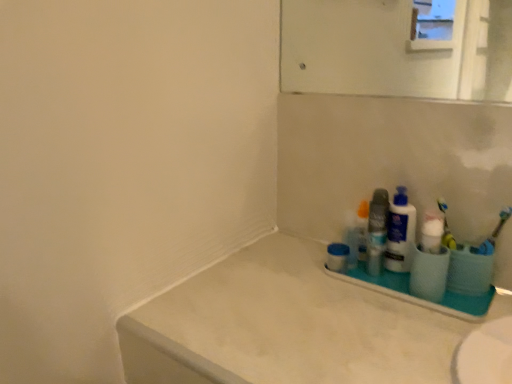
Question: From the image's perspective, is white plastic bottle at right, which is counted as the first cleaning product, starting from the back, on top of yellow plastic toothbrush at right, the 2th toothbrush in the right-to-left sequence?

Choices:
 (A) yes
 (B) no

Answer: (B)

Question: From the image's perspective, is white plastic bottle at right, which is the 2th cleaning product in front-to-back order, located beneath yellow plastic toothbrush at right, the 2th toothbrush in the right-to-left sequence?

Choices:
 (A) no
 (B) yes

Answer: (B)

Question: Does white plastic bottle at right, which is counted as the first cleaning product, starting from the back, have a greater height compared to yellow plastic toothbrush at right, which is counted as the first toothbrush, starting from the left?

Choices:
 (A) no
 (B) yes

Answer: (B)

Question: Is white plastic bottle at right, which is the 2th cleaning product in front-to-back order, wider than yellow plastic toothbrush at right, the 2th toothbrush in the right-to-left sequence?

Choices:
 (A) no
 (B) yes

Answer: (B)

Question: Is yellow plastic toothbrush at right, the 2th toothbrush in the right-to-left sequence, a part of white plastic bottle at right, which is counted as the first cleaning product, starting from the back?

Choices:
 (A) yes
 (B) no

Answer: (B)

Question: From a real-world perspective, is white plastic bottle at right, which is the 2th cleaning product in front-to-back order, physically located above or below white plastic tray at lower right?

Choices:
 (A) above
 (B) below

Answer: (A)

Question: From the image's perspective, is white plastic bottle at right, which is the 2th cleaning product in front-to-back order, above or below white plastic tray at lower right?

Choices:
 (A) above
 (B) below

Answer: (A)

Question: Considering their positions, is white plastic bottle at right, which is counted as the first cleaning product, starting from the back, located in front of or behind white plastic tray at lower right?

Choices:
 (A) front
 (B) behind

Answer: (B)

Question: Considering the relative positions of white plastic bottle at right, which is the 2th cleaning product in front-to-back order, and white plastic tray at lower right in the image provided, is white plastic bottle at right, which is the 2th cleaning product in front-to-back order, to the left or to the right of white plastic tray at lower right?

Choices:
 (A) left
 (B) right

Answer: (A)

Question: Would you say white plastic tray at lower right is inside or outside yellow plastic toothbrush at right, the 2th toothbrush in the right-to-left sequence?

Choices:
 (A) inside
 (B) outside

Answer: (B)

Question: From the image's perspective, is white plastic tray at lower right located above or below yellow plastic toothbrush at right, the 2th toothbrush in the right-to-left sequence?

Choices:
 (A) above
 (B) below

Answer: (B)

Question: Considering the positions of white plastic tray at lower right and yellow plastic toothbrush at right, the 2th toothbrush in the right-to-left sequence, in the image, is white plastic tray at lower right bigger or smaller than yellow plastic toothbrush at right, the 2th toothbrush in the right-to-left sequence,?

Choices:
 (A) small
 (B) big

Answer: (B)

Question: Is white plastic tray at lower right taller or shorter than yellow plastic toothbrush at right, the 2th toothbrush in the right-to-left sequence?

Choices:
 (A) tall
 (B) short

Answer: (B)

Question: Is blue rubber toothbrush at right, which is the second toothbrush from left to right, taller or shorter than yellow plastic toothbrush at right, the 2th toothbrush in the right-to-left sequence?

Choices:
 (A) tall
 (B) short

Answer: (B)

Question: Looking at the image, does blue rubber toothbrush at right, which is the second toothbrush from left to right, seem bigger or smaller compared to yellow plastic toothbrush at right, which is counted as the first toothbrush, starting from the left?

Choices:
 (A) small
 (B) big

Answer: (A)